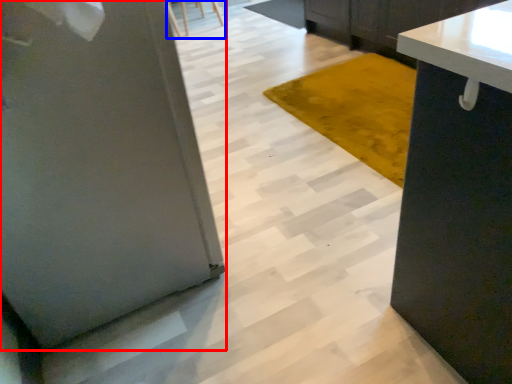
Question: Among these objects, which one is farthest to the camera, pillar (highlighted by a red box) or chair (highlighted by a blue box)?

Choices:
 (A) pillar
 (B) chair

Answer: (B)